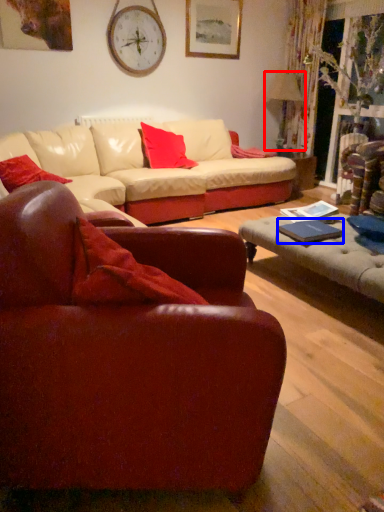
Question: Which object is closer to the camera taking this photo, lamp (highlighted by a red box) or pad (highlighted by a blue box)?

Choices:
 (A) lamp
 (B) pad

Answer: (B)